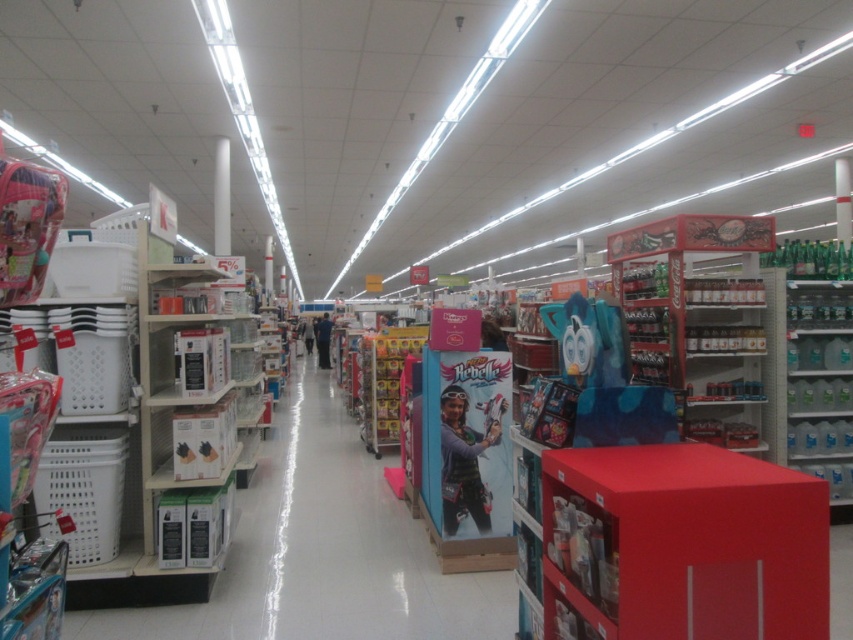
You are standing in the middle of the retail store aisle. You need to reach the green plastic pillar at center. Which direction should you move to get there?

Since the green plastic pillar at center is located at coordinates 0.314 on the x and 0.988 on the y, you should move towards the center of the aisle to reach it.

You are a store employee who needs to place a new display stand that is 1.2 meters tall. You see the green plastic pillar at center and the matte black jacket at center. Which object should you choose to place the display stand on top of?

The green plastic pillar at center is shorter than the matte black jacket at center, so the display stand should be placed on the matte black jacket at center because it is taller and can support the height required.

You are a store employee who needs to place a new 1.5 meter tall display on the floor. Considering the white glossy pillar at center and the green plastic pillar at center, which pillar should you avoid placing the display in front of to ensure it doesn

The white glossy pillar at center is much taller than the green plastic pillar at center. Therefore, placing the display in front of the white glossy pillar at center may block the view of the taller pillar, so it is better to place the display in front of the green plastic pillar at center instead.